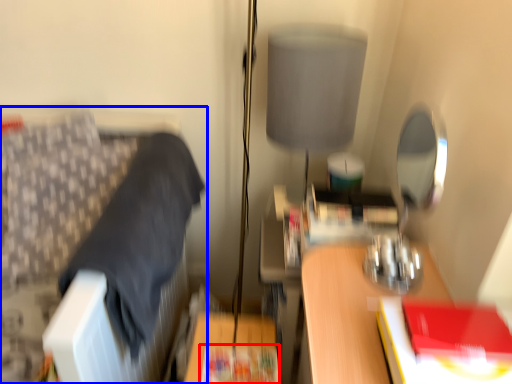
Question: Which object is further to the camera taking this photo, paperback book (highlighted by a red box) or furniture (highlighted by a blue box)?

Choices:
 (A) paperback book
 (B) furniture

Answer: (A)